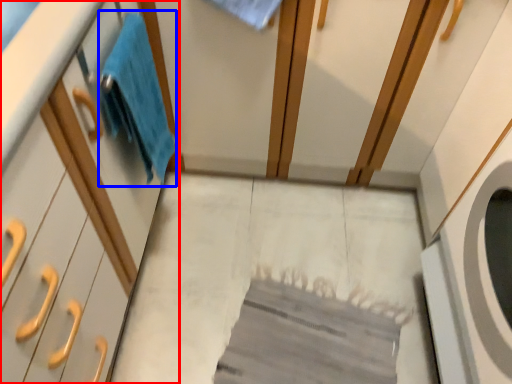
Question: Which object appears farthest to the camera in this image, cabinetry (highlighted by a red box) or bath towel (highlighted by a blue box)?

Choices:
 (A) cabinetry
 (B) bath towel

Answer: (B)